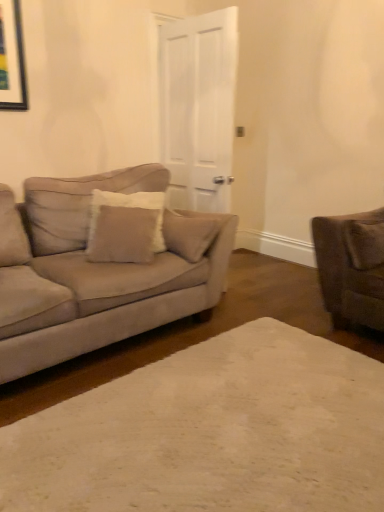
What do you see at coordinates (211, 433) in the screenshot? This screenshot has width=384, height=512. I see `beige carpet at center` at bounding box center [211, 433].

This screenshot has width=384, height=512. What are the coordinates of `suede beige couch at left` in the screenshot? It's located at (100, 267).

Is suede-like brown pillow at right, acting as the second pillow starting from the left, spatially inside beige fabric pillow at center, the 2th pillow in the right-to-left sequence, or outside of it?

suede-like brown pillow at right, acting as the second pillow starting from the left, is not enclosed by beige fabric pillow at center, the 2th pillow in the right-to-left sequence.

Considering the relative sizes of suede-like brown pillow at right, positioned as the 1th pillow in right-to-left order, and beige fabric pillow at center, the 2th pillow in the right-to-left sequence, in the image provided, is suede-like brown pillow at right, positioned as the 1th pillow in right-to-left order, smaller than beige fabric pillow at center, the 2th pillow in the right-to-left sequence,?

Yes, suede-like brown pillow at right, positioned as the 1th pillow in right-to-left order, is smaller than beige fabric pillow at center, the 2th pillow in the right-to-left sequence.

In terms of height, does suede-like brown pillow at right, acting as the second pillow starting from the left, look taller or shorter compared to beige fabric pillow at center, placed as the first pillow when sorted from left to right?

suede-like brown pillow at right, acting as the second pillow starting from the left, is shorter than beige fabric pillow at center, placed as the first pillow when sorted from left to right.

Is suede-like brown pillow at right, acting as the second pillow starting from the left, positioned far away from beige fabric pillow at center, placed as the first pillow when sorted from left to right?

Yes, suede-like brown pillow at right, acting as the second pillow starting from the left, is far from beige fabric pillow at center, placed as the first pillow when sorted from left to right.

From a real-world perspective, starting from the white matte door at center, which pillow is the 2nd one below it? Please provide its 2D coordinates.

[(364, 243)]

Is point (376, 243) positioned behind point (162, 66)?

No, (376, 243) is in front of (162, 66).

Which object is wider, suede-like brown pillow at right, acting as the second pillow starting from the left, or white matte door at center?

With larger width is suede-like brown pillow at right, acting as the second pillow starting from the left.

From the image's perspective, relative to white matte door at center, is suede-like brown pillow at right, acting as the second pillow starting from the left, above or below?

From the image's perspective, suede-like brown pillow at right, acting as the second pillow starting from the left, appears below white matte door at center.

Is beige carpet at center situated inside suede beige couch at left or outside?

beige carpet at center is not inside suede beige couch at left, it's outside.

Is beige carpet at center taller than suede beige couch at left?

No, beige carpet at center is not taller than suede beige couch at left.

Considering the sizes of objects beige carpet at center and suede beige couch at left in the image provided, who is smaller, beige carpet at center or suede beige couch at left?

beige carpet at center.

Is beige carpet at center inside suede beige couch at left?

No, suede beige couch at left does not contain beige carpet at center.

In terms of height, does suede beige couch at left look taller or shorter compared to beige carpet at center?

suede beige couch at left is taller than beige carpet at center.

At what (x,y) coordinates should I click in order to perform the action: click on plain below the suede beige couch at left (from a real-world perspective). Please return your answer as a coordinate pair (x, y). The width and height of the screenshot is (384, 512). Looking at the image, I should click on (211, 433).

Which is in front, point (145, 405) or point (107, 226)?

Point (145, 405)

In order to click on plain located in front of the beige fabric pillow at center, the 2th pillow in the right-to-left sequence in this screenshot , I will do `click(211, 433)`.

Does beige carpet at center turn towards beige fabric pillow at center, placed as the first pillow when sorted from left to right?

No, beige carpet at center is not oriented towards beige fabric pillow at center, placed as the first pillow when sorted from left to right.

Which of these two, beige carpet at center or beige fabric pillow at center, the 2th pillow in the right-to-left sequence, is wider?

With larger width is beige carpet at center.

Is point (143, 229) positioned in front of point (188, 186)?

Yes, point (143, 229) is in front of point (188, 186).

Considering the positions of objects beige fabric pillow at center, the 2th pillow in the right-to-left sequence, and white matte door at center in the image provided, who is in front, beige fabric pillow at center, the 2th pillow in the right-to-left sequence, or white matte door at center?

beige fabric pillow at center, the 2th pillow in the right-to-left sequence, is in front.

Which is in front, point (89, 267) or point (227, 211)?

The point (89, 267) is in front.

Where is `studio couch in front of the white matte door at center`? studio couch in front of the white matte door at center is located at coordinates (100, 267).

From a real-world perspective, is suede beige couch at left on top of white matte door at center?

Incorrect, from a real-world perspective, suede beige couch at left is lower than white matte door at center.

This screenshot has height=512, width=384. In the image, there is a beige fabric pillow at center, the 2th pillow in the right-to-left sequence. Find the location of `pillow below it (from a real-world perspective)`. pillow below it (from a real-world perspective) is located at coordinates (364, 243).

The image size is (384, 512). What are the coordinates of `glass door that is behind the suede-like brown pillow at right, acting as the second pillow starting from the left` in the screenshot? It's located at (198, 108).

When comparing their distances from beige fabric pillow at center, placed as the first pillow when sorted from left to right, does suede beige couch at left or beige carpet at center seem further?

beige carpet at center is positioned further to the anchor beige fabric pillow at center, placed as the first pillow when sorted from left to right.

When comparing their distances from white matte door at center, does beige fabric pillow at center, placed as the first pillow when sorted from left to right, or beige carpet at center seem further?

beige carpet at center is further to white matte door at center.

Considering their positions, is suede-like brown pillow at right, acting as the second pillow starting from the left, positioned further to beige carpet at center than beige fabric pillow at center, the 2th pillow in the right-to-left sequence?

The object further to beige carpet at center is suede-like brown pillow at right, acting as the second pillow starting from the left.

Based on their spatial positions, is white matte door at center or beige fabric pillow at center, placed as the first pillow when sorted from left to right, further from suede-like brown pillow at right, positioned as the 1th pillow in right-to-left order?

The object further to suede-like brown pillow at right, positioned as the 1th pillow in right-to-left order, is white matte door at center.

Considering their positions, is suede-like brown pillow at right, acting as the second pillow starting from the left, positioned further to beige carpet at center than white matte door at center?

white matte door at center is further to beige carpet at center.

Which object lies nearer to the anchor point suede-like brown pillow at right, positioned as the 1th pillow in right-to-left order, beige fabric pillow at center, placed as the first pillow when sorted from left to right, or suede beige couch at left?

The object closer to suede-like brown pillow at right, positioned as the 1th pillow in right-to-left order, is beige fabric pillow at center, placed as the first pillow when sorted from left to right.

Estimate the real-world distances between objects in this image. Which object is closer to suede-like brown pillow at right, acting as the second pillow starting from the left, white matte door at center or beige carpet at center?

beige carpet at center is positioned closer to the anchor suede-like brown pillow at right, acting as the second pillow starting from the left.

Based on their spatial positions, is beige carpet at center or white matte door at center further from beige fabric pillow at center, the 2th pillow in the right-to-left sequence?

Among the two, beige carpet at center is located further to beige fabric pillow at center, the 2th pillow in the right-to-left sequence.

I want to click on studio couch between beige carpet at center and beige fabric pillow at center, the 2th pillow in the right-to-left sequence, along the z-axis, so click(x=100, y=267).

Where is `pillow between suede beige couch at left and suede-like brown pillow at right, positioned as the 1th pillow in right-to-left order, from left to right`? This screenshot has height=512, width=384. pillow between suede beige couch at left and suede-like brown pillow at right, positioned as the 1th pillow in right-to-left order, from left to right is located at coordinates (125, 227).

The image size is (384, 512). In order to click on glass door situated between suede beige couch at left and suede-like brown pillow at right, acting as the second pillow starting from the left, from left to right in this screenshot , I will do `click(198, 108)`.

Find the location of a particular element. This screenshot has width=384, height=512. pillow located between beige carpet at center and suede-like brown pillow at right, positioned as the 1th pillow in right-to-left order, in the depth direction is located at coordinates (125, 227).